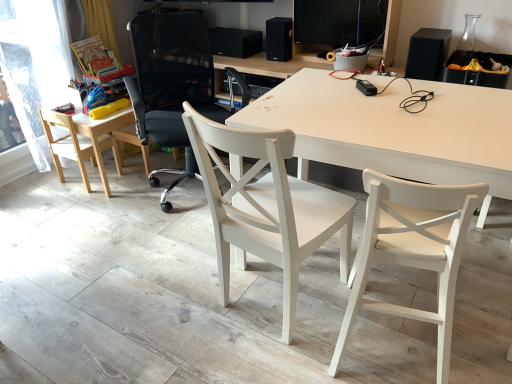
Question: Can you confirm if white matte desk at center is positioned to the left of black matte speaker at upper center, which is the second speaker from front to back?

Choices:
 (A) no
 (B) yes

Answer: (A)

Question: Is white matte desk at center further to the viewer compared to black matte speaker at upper center, which is the second speaker from front to back?

Choices:
 (A) no
 (B) yes

Answer: (A)

Question: Considering the relative sizes of white matte desk at center and black matte speaker at upper center, which ranks as the 2th speaker in right-to-left order, in the image provided, is white matte desk at center thinner than black matte speaker at upper center, which ranks as the 2th speaker in right-to-left order,?

Choices:
 (A) yes
 (B) no

Answer: (B)

Question: From a real-world perspective, is white matte desk at center on black matte speaker at upper center, arranged as the second speaker when viewed from the left?

Choices:
 (A) yes
 (B) no

Answer: (B)

Question: Does white matte desk at center turn towards black matte speaker at upper center, which is the second speaker from front to back?

Choices:
 (A) yes
 (B) no

Answer: (B)

Question: Considering the positions of white wood chair at center, placed as the 2th chair when sorted from right to left, and black matte speaker at upper center, which is the 1th speaker in back-to-front order, in the image, is white wood chair at center, placed as the 2th chair when sorted from right to left, taller or shorter than black matte speaker at upper center, which is the 1th speaker in back-to-front order,?

Choices:
 (A) short
 (B) tall

Answer: (B)

Question: In the image, is white wood chair at center, acting as the 3th chair starting from the left, positioned in front of or behind black matte speaker at upper center, which is the 1th speaker in back-to-front order?

Choices:
 (A) behind
 (B) front

Answer: (B)

Question: From the image's perspective, is white wood chair at center, placed as the 2th chair when sorted from right to left, above or below black matte speaker at upper center, marked as the 3th speaker in a right-to-left arrangement?

Choices:
 (A) below
 (B) above

Answer: (A)

Question: Looking at the image, does white wood chair at center, placed as the 2th chair when sorted from right to left, seem bigger or smaller compared to black matte speaker at upper center, the 3th speaker when ordered from front to back?

Choices:
 (A) big
 (B) small

Answer: (A)

Question: From the image's perspective, is white matte desk at center located above or below white wood chair at center, placed as the 2th chair when sorted from right to left?

Choices:
 (A) below
 (B) above

Answer: (B)

Question: From a real-world perspective, is white matte desk at center physically located above or below white wood chair at center, acting as the 3th chair starting from the left?

Choices:
 (A) above
 (B) below

Answer: (B)

Question: Based on their positions, is white matte desk at center located to the left or right of white wood chair at center, placed as the 2th chair when sorted from right to left?

Choices:
 (A) right
 (B) left

Answer: (A)

Question: Is white matte desk at center inside the boundaries of white wood chair at center, acting as the 3th chair starting from the left, or outside?

Choices:
 (A) inside
 (B) outside

Answer: (B)

Question: From the image's perspective, relative to black matte speaker at upper center, which ranks as the 2th speaker in right-to-left order, is white matte desk at center above or below?

Choices:
 (A) above
 (B) below

Answer: (B)

Question: Does point (367, 117) appear closer or farther from the camera than point (272, 39)?

Choices:
 (A) closer
 (B) farther

Answer: (A)